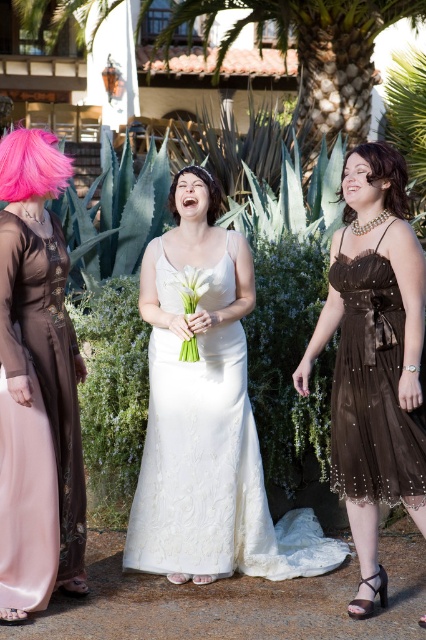
Does pink satin dress at left have a greater width compared to brown shiny hair at upper right?

No, pink satin dress at left is not wider than brown shiny hair at upper right.

Is pink satin dress at left positioned before brown shiny hair at upper right?

Yes, pink satin dress at left is closer to the viewer.

Is point (34, 467) closer to viewer compared to point (362, 148)?

Yes, it is in front of point (362, 148).

This screenshot has height=640, width=426. I want to click on pink satin dress at left, so click(x=37, y=372).

Does ivory satin dress at center appear under pink fluffy wig at upper left?

Yes, ivory satin dress at center is below pink fluffy wig at upper left.

Consider the image. Can you confirm if ivory satin dress at center is bigger than pink fluffy wig at upper left?

Yes.

At what (x,y) coordinates should I click in order to perform the action: click on ivory satin dress at center. Please return your answer as a coordinate pair (x, y). Looking at the image, I should click on (212, 474).

Where is `ivory satin dress at center`? This screenshot has width=426, height=640. ivory satin dress at center is located at coordinates (212, 474).

Does brown satin dress at center have a greater width compared to dark brown curly hair at center?

Correct, the width of brown satin dress at center exceeds that of dark brown curly hair at center.

Which is more to the left, brown satin dress at center or dark brown curly hair at center?

From the viewer's perspective, dark brown curly hair at center appears more on the left side.

Which is behind, point (367, 356) or point (210, 177)?

The point (210, 177) is more distant.

Where is `brown satin dress at center`? brown satin dress at center is located at coordinates (374, 356).